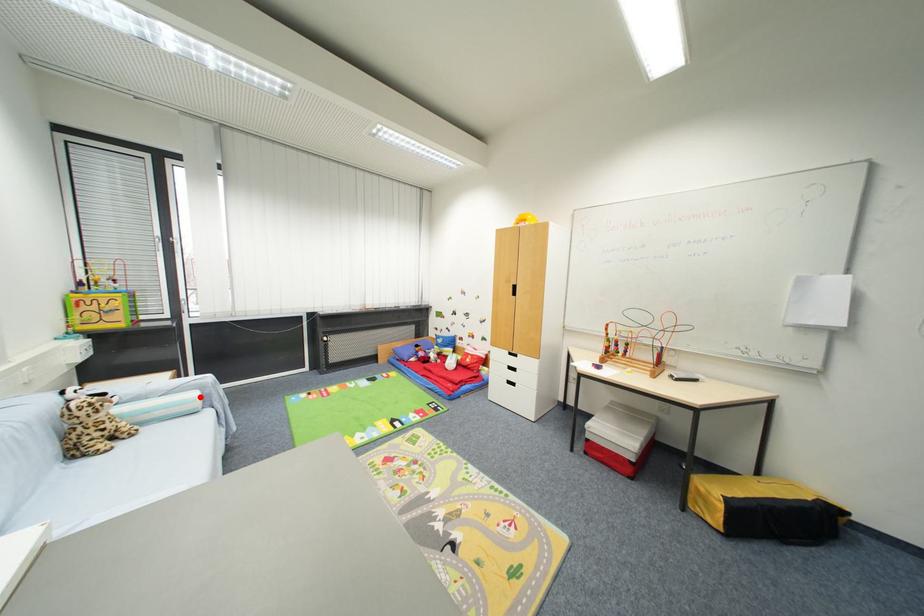
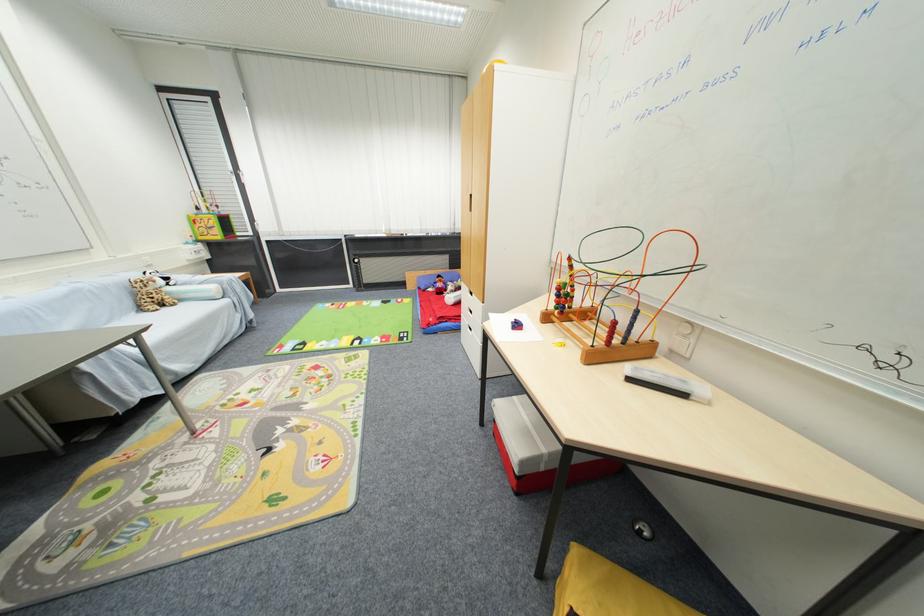
Find the pixel in the second image that matches the highlighted location in the first image.

(217, 290)